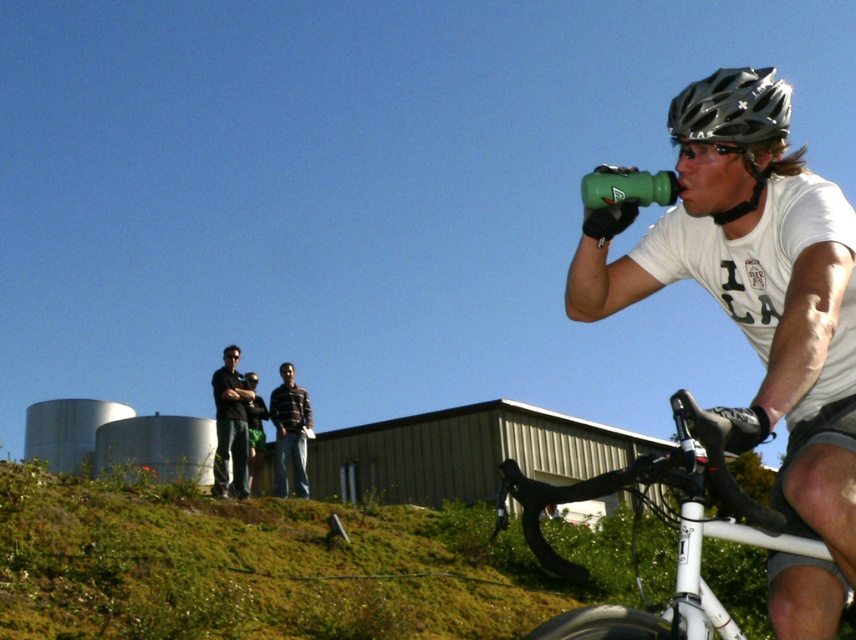
Question: Which object is positioned closest to the black matte helmet at upper right?

Choices:
 (A) green matte water bottle at right
 (B) dark blue jeans at center
 (C) striped cotton shirt at center
 (D) white matte bicycle at lower right

Answer: (A)

Question: Among these objects, which one is nearest to the camera?

Choices:
 (A) black matte helmet at upper right
 (B) striped cotton shirt at center
 (C) green matte water bottle at right
 (D) white matte bicycle at lower right

Answer: (D)

Question: Can you confirm if black matte helmet at upper right is thinner than striped cotton shirt at center?

Choices:
 (A) yes
 (B) no

Answer: (A)

Question: Which object appears closest to the camera in this image?

Choices:
 (A) striped cotton shirt at center
 (B) dark blue jeans at center
 (C) green matte water bottle at right

Answer: (C)

Question: Does green matte water bottle at right have a smaller size compared to striped cotton shirt at center?

Choices:
 (A) yes
 (B) no

Answer: (A)

Question: Is dark blue jeans at center below striped cotton shirt at center?

Choices:
 (A) no
 (B) yes

Answer: (A)